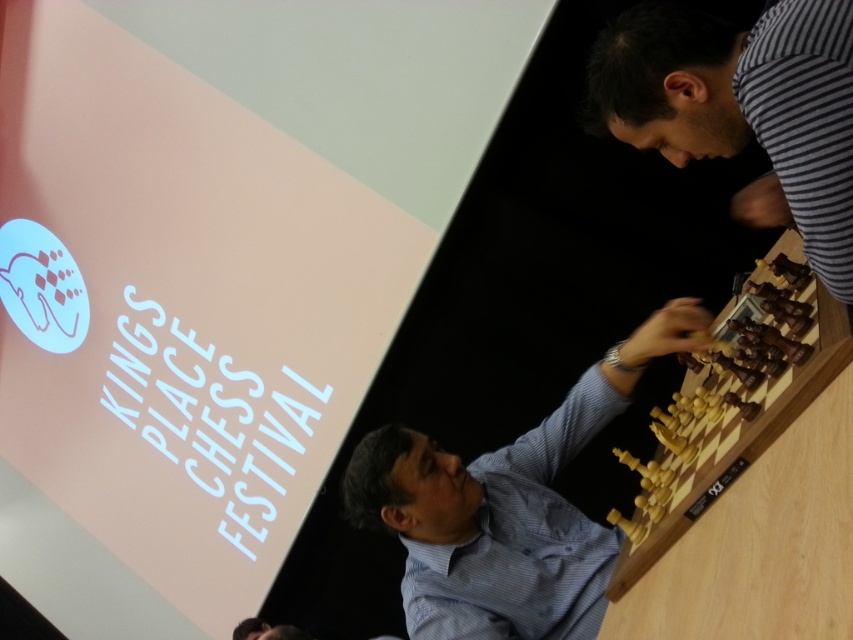
You are organizing a chess tournament and need to choose between the light brown wood chess set at center and the light wood chess set at right. Based on their sizes, which set would be more suitable for a standard chessboard?

The light brown wood chess set at center is larger in size than the light wood chess set at right, so it would be more suitable for a standard chessboard as it provides better visibility and ease of handling during the tournament.

You are a photographer at the Kings Place Chess Festival. You want to take a picture of the chess set and the striped fabric in the background. Can you confirm if the striped fabric at upper right is positioned behind the light brown wood chess set at center?

Yes, the striped fabric at upper right is positioned behind the light brown wood chess set at center according to the description.